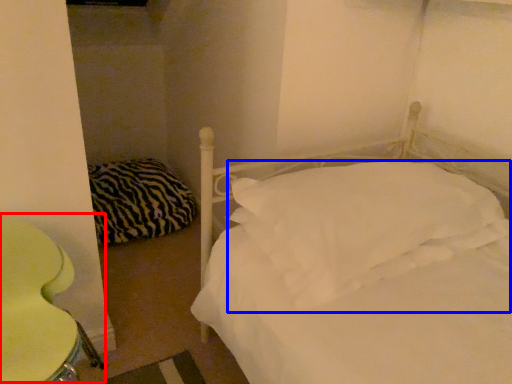
Question: Which object appears closest to the camera in this image, swivel chair (highlighted by a red box) or pillow (highlighted by a blue box)?

Choices:
 (A) swivel chair
 (B) pillow

Answer: (A)